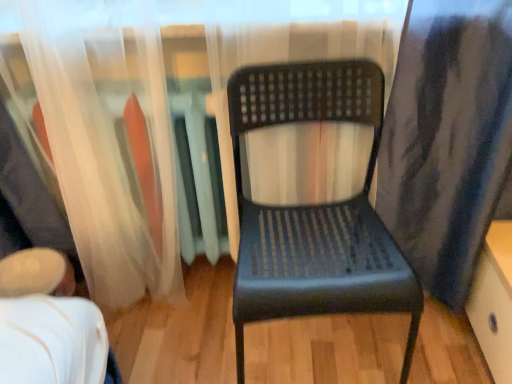
Where is `vacant space in matte black chair at center (from a real-world perspective)`? vacant space in matte black chair at center (from a real-world perspective) is located at coordinates click(x=304, y=348).